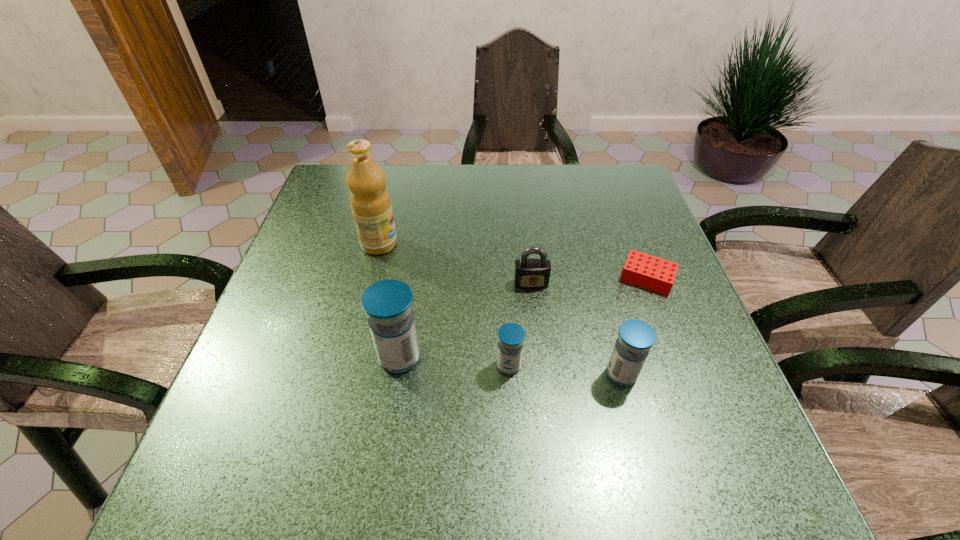
Where is `the leftmost medicine`? The width and height of the screenshot is (960, 540). the leftmost medicine is located at coordinates (388, 304).

This screenshot has width=960, height=540. Find the location of `the second object from left to right`. the second object from left to right is located at coordinates (388, 304).

Image resolution: width=960 pixels, height=540 pixels. In order to click on the second medicine from left to right in this screenshot , I will do `click(511, 336)`.

What are the coordinates of `the second tallest medicine` in the screenshot? It's located at (635, 338).

Find the location of a particular element. The height and width of the screenshot is (540, 960). the rightmost medicine is located at coordinates (635, 338).

The width and height of the screenshot is (960, 540). In order to click on padlock in this screenshot , I will do `click(531, 273)`.

At what (x,y) coordinates should I click in order to perform the action: click on the leftmost object. Please return your answer as a coordinate pair (x, y). Looking at the image, I should click on (370, 203).

Find the location of a particular element. This screenshot has width=960, height=540. the tallest object is located at coordinates (370, 203).

Locate an element on the screen. The width and height of the screenshot is (960, 540). the shortest object is located at coordinates (647, 271).

The width and height of the screenshot is (960, 540). I want to click on Lego, so click(x=647, y=271).